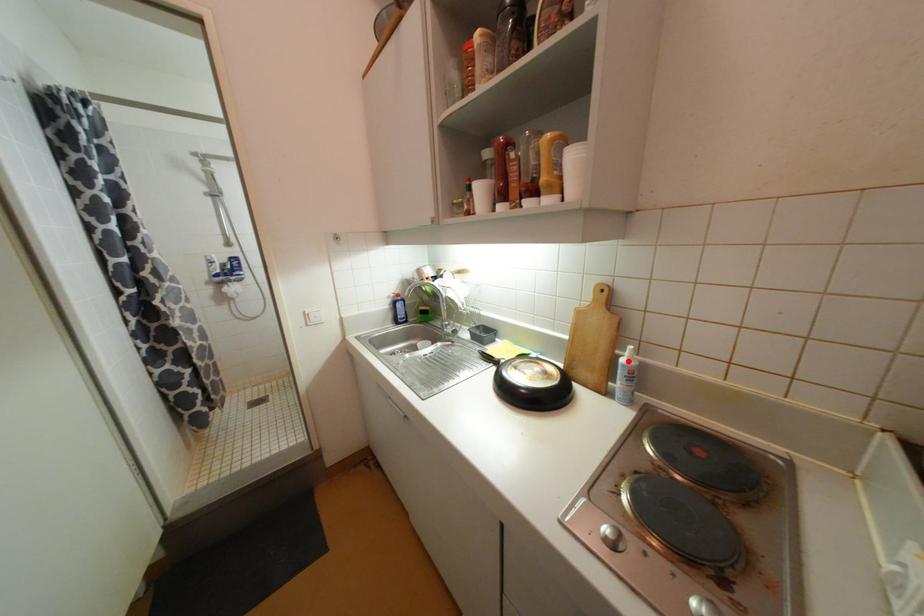
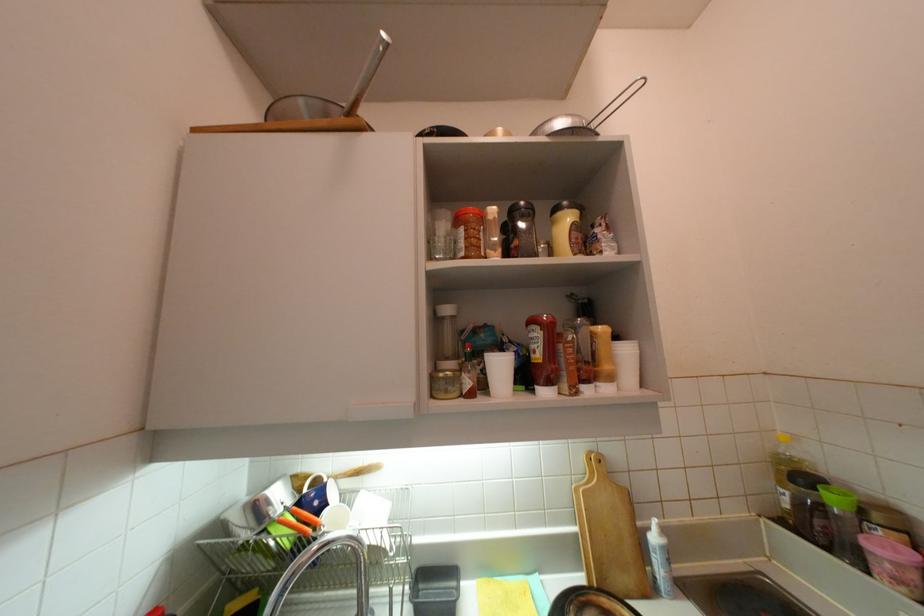
Locate, in the second image, the point that corresponds to the highlighted location in the first image.

(660, 540)